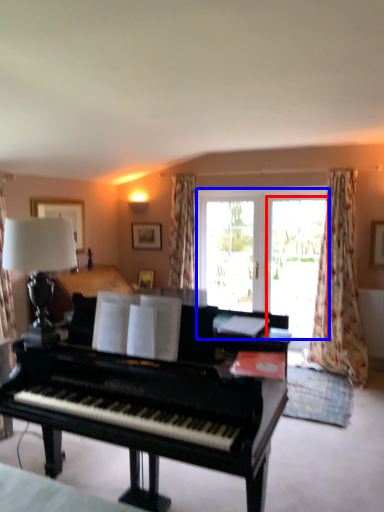
Question: Which of the following is the farthest to the observer, screen door (highlighted by a red box) or bay window (highlighted by a blue box)?

Choices:
 (A) screen door
 (B) bay window

Answer: (B)